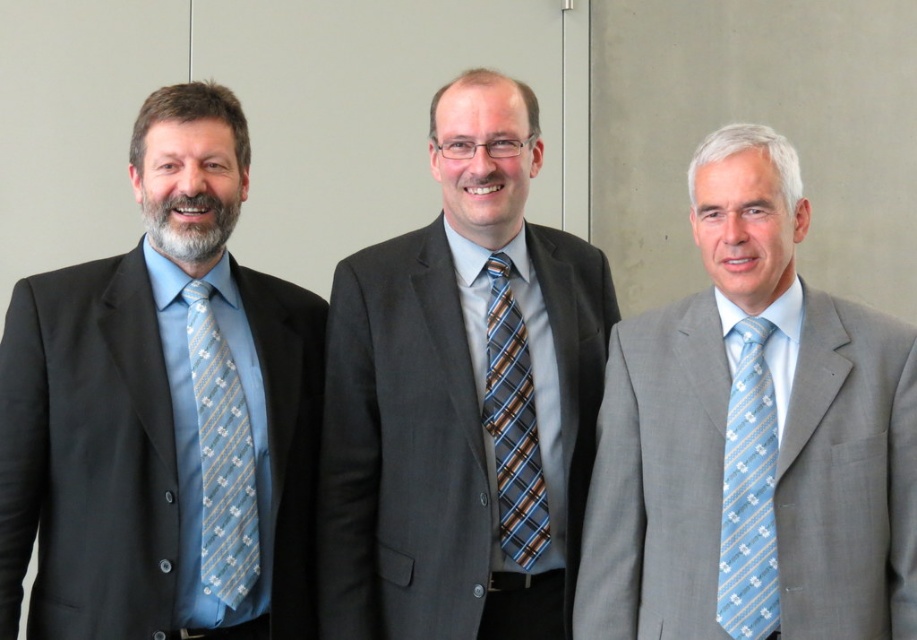
You are a photographer arranging three men for a professional photo shoot. The men are positioned against a plain wall. You need to ensure that the light gray suit at right and the light blue silk tie at left are visible in the frame. Based on their positions, which object is higher in the image?

The light gray suit at right is above the light blue silk tie at left, so the light gray suit at right is higher in the image.

You are organizing a formal event and need to ensure that the attire of the participants meets specific size requirements. The light gray suit at right must be at least twice the size of the light blue silk tie at left to comply with the event guidelines. Does the current arrangement meet this requirement?

The light gray suit at right is larger in size than the light blue silk tie at left, but it is not specified whether it is twice the size. Therefore, we cannot confirm if it meets the requirement without additional information about the exact sizes.